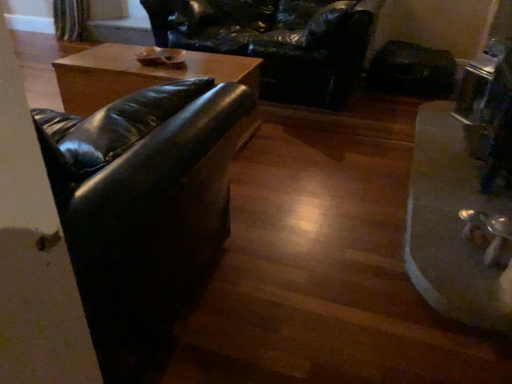
Question: Is black leather swivel chair at upper center wider than black leather couch at left?

Choices:
 (A) no
 (B) yes

Answer: (B)

Question: Is black leather swivel chair at upper center at the right side of black leather couch at left?

Choices:
 (A) yes
 (B) no

Answer: (A)

Question: Does black leather swivel chair at upper center have a lesser width compared to black leather couch at left?

Choices:
 (A) no
 (B) yes

Answer: (A)

Question: Does black leather swivel chair at upper center lie behind black leather couch at left?

Choices:
 (A) yes
 (B) no

Answer: (A)

Question: Considering the relative sizes of black leather swivel chair at upper center and black leather couch at left in the image provided, is black leather swivel chair at upper center taller than black leather couch at left?

Choices:
 (A) no
 (B) yes

Answer: (A)

Question: Is black leather couch at left a part of black leather swivel chair at upper center?

Choices:
 (A) yes
 (B) no

Answer: (B)

Question: From the image's perspective, is black leather swivel chair at upper center below metallic silver tray at lower right?

Choices:
 (A) no
 (B) yes

Answer: (A)

Question: Considering the relative positions of black leather swivel chair at upper center and metallic silver tray at lower right in the image provided, is black leather swivel chair at upper center behind metallic silver tray at lower right?

Choices:
 (A) yes
 (B) no

Answer: (A)

Question: Is black leather swivel chair at upper center thinner than metallic silver tray at lower right?

Choices:
 (A) yes
 (B) no

Answer: (B)

Question: Does black leather swivel chair at upper center have a greater height compared to metallic silver tray at lower right?

Choices:
 (A) no
 (B) yes

Answer: (B)

Question: From the image's perspective, is black leather swivel chair at upper center on metallic silver tray at lower right?

Choices:
 (A) yes
 (B) no

Answer: (A)

Question: Considering the relative sizes of black leather swivel chair at upper center and metallic silver tray at lower right in the image provided, is black leather swivel chair at upper center smaller than metallic silver tray at lower right?

Choices:
 (A) yes
 (B) no

Answer: (B)

Question: From a real-world perspective, does black leather couch at left sit lower than metallic silver tray at lower right?

Choices:
 (A) yes
 (B) no

Answer: (B)